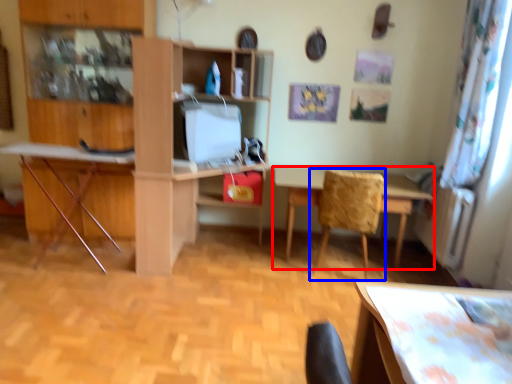
Question: Which object is further to the camera taking this photo, table (highlighted by a red box) or chair (highlighted by a blue box)?

Choices:
 (A) table
 (B) chair

Answer: (A)